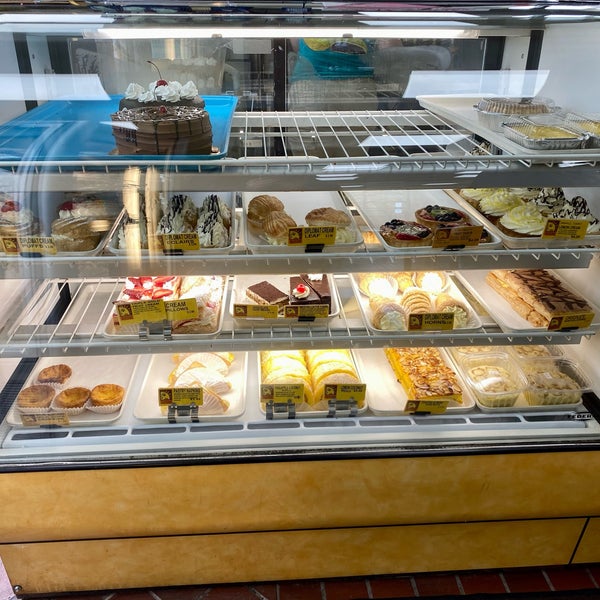
This screenshot has width=600, height=600. Find the location of `metal rack`. metal rack is located at coordinates (102, 342), (117, 259), (271, 163).